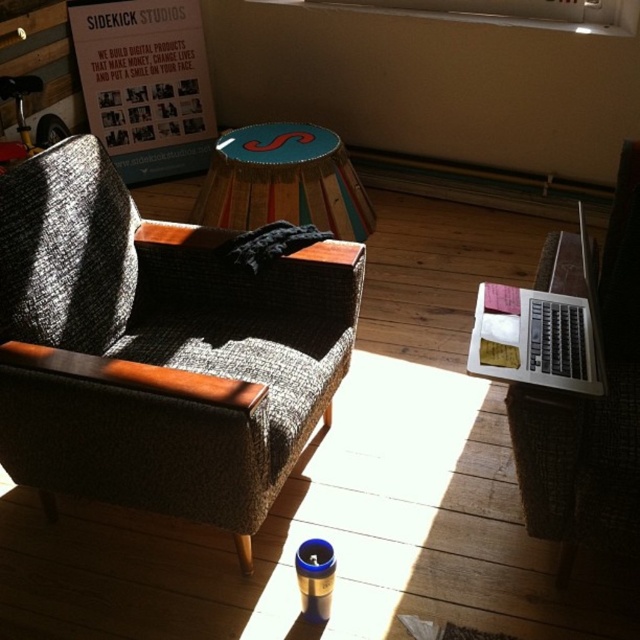
You are a person who wants to sit down comfortably. You see the textured gray couch at left and the wooden stool at center. Which one is taller and would provide a higher seating position?

The textured gray couch at left is much taller than the wooden stool at center, so it would provide a higher seating position.